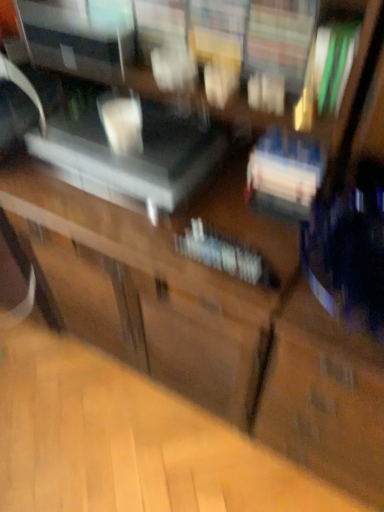
Question: Would you say satin silver speaker at center is inside or outside white glossy book at center?

Choices:
 (A) inside
 (B) outside

Answer: (B)

Question: Considering the positions of satin silver speaker at center and white glossy book at center in the image, is satin silver speaker at center wider or thinner than white glossy book at center?

Choices:
 (A) thin
 (B) wide

Answer: (B)

Question: Is satin silver speaker at center to the left or to the right of white glossy book at center in the image?

Choices:
 (A) right
 (B) left

Answer: (B)

Question: Is white glossy book at center wider or thinner than satin silver speaker at center?

Choices:
 (A) thin
 (B) wide

Answer: (A)

Question: Considering their positions, is white glossy book at center located in front of or behind satin silver speaker at center?

Choices:
 (A) front
 (B) behind

Answer: (A)

Question: From a real-world perspective, is white glossy book at center above or below satin silver speaker at center?

Choices:
 (A) below
 (B) above

Answer: (A)

Question: From their relative heights in the image, would you say white glossy book at center is taller or shorter than satin silver speaker at center?

Choices:
 (A) short
 (B) tall

Answer: (A)